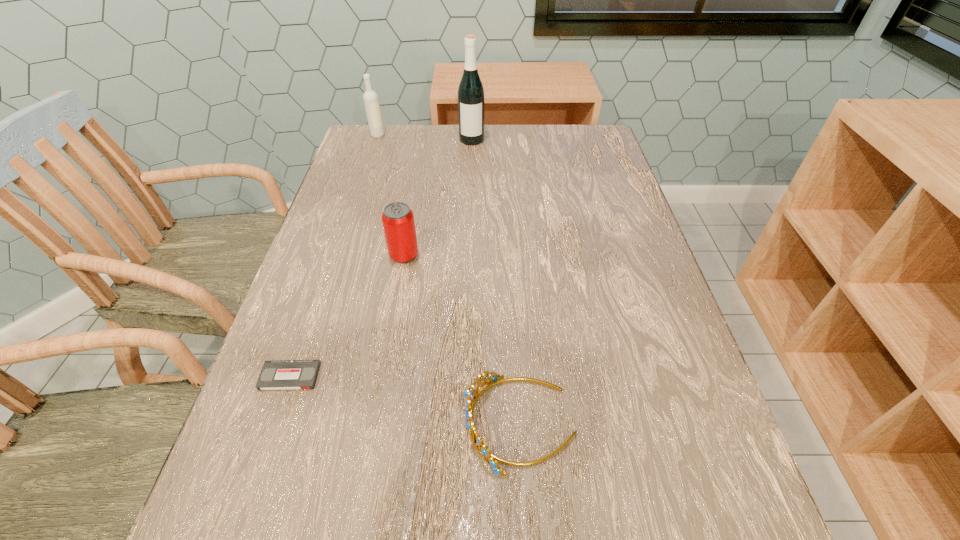
The height and width of the screenshot is (540, 960). In order to click on wine bottle in this screenshot , I will do `click(471, 94)`.

I want to click on the fourth shortest object, so click(370, 97).

Locate an element on the screen. the third object from right to left is located at coordinates (398, 222).

This screenshot has height=540, width=960. Identify the location of can. (398, 222).

Where is `tiara`? This screenshot has width=960, height=540. tiara is located at coordinates (491, 379).

The height and width of the screenshot is (540, 960). I want to click on the shortest object, so pos(281,374).

This screenshot has height=540, width=960. I want to click on vacant space positioned 0.110m on the label of the wine bottle, so coord(471,166).

Find the location of a particular element. vacant space situated on the front of the vodka is located at coordinates (368, 167).

Identify the location of free space located on the back of the third shortest object. This screenshot has width=960, height=540. (411, 219).

Locate an element on the screen. The height and width of the screenshot is (540, 960). vacant area situated on the front-facing side of the second shortest object is located at coordinates (271, 423).